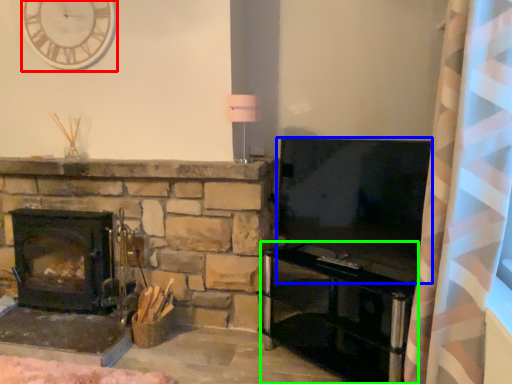
Question: Which object is the farthest from clock (highlighted by a red box)? Choose among these: television (highlighted by a blue box) or entertainment center (highlighted by a green box).

Choices:
 (A) television
 (B) entertainment center

Answer: (B)